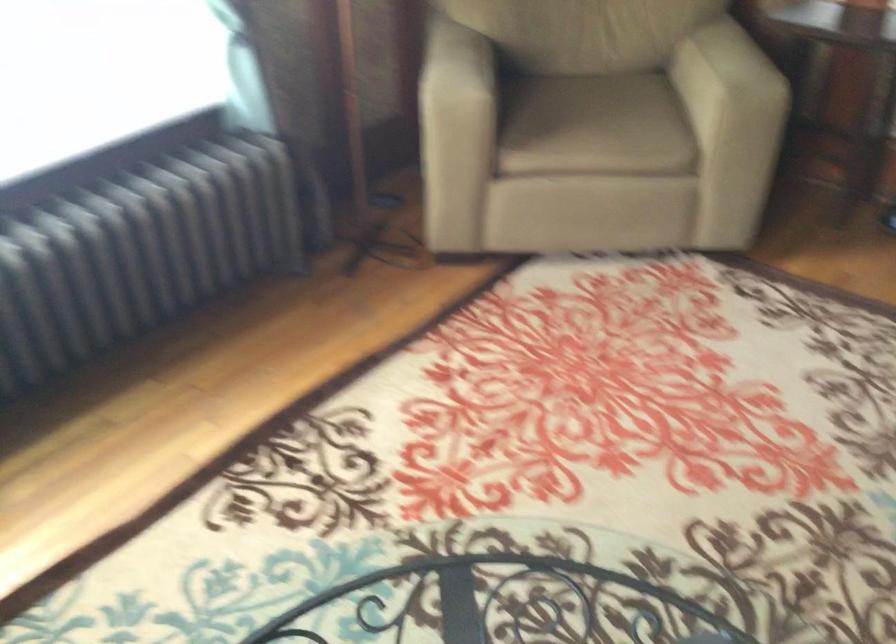
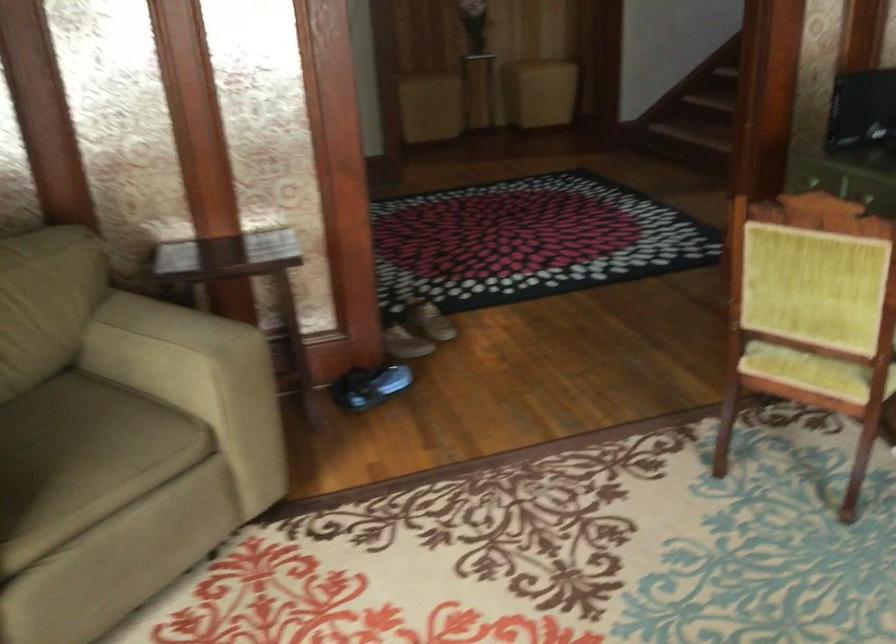
Where in the second image is the point corresponding to point (590, 128) from the first image?

(82, 459)